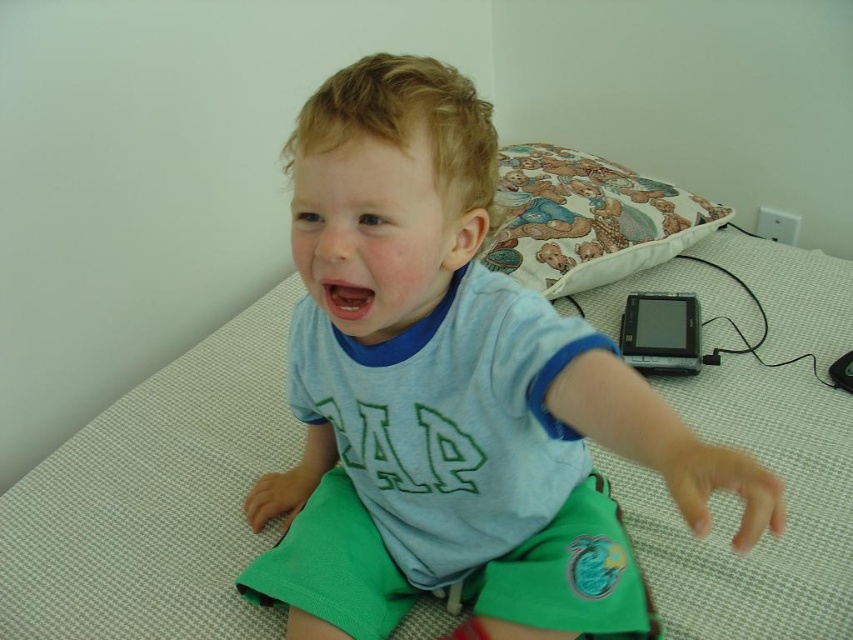
Question: Does light blue cotton shirt at center have a greater width compared to fluffy fabric pillow at upper right?

Choices:
 (A) no
 (B) yes

Answer: (A)

Question: Among these points, which one is nearest to the camera?

Choices:
 (A) (479, 304)
 (B) (627, 177)

Answer: (A)

Question: Among these points, which one is farthest from the camera?

Choices:
 (A) [x=563, y=188]
 (B) [x=448, y=132]

Answer: (A)

Question: Can you confirm if light blue cotton shirt at center is wider than fluffy fabric pillow at upper right?

Choices:
 (A) yes
 (B) no

Answer: (B)

Question: Does light blue cotton shirt at center come behind fluffy fabric pillow at upper right?

Choices:
 (A) no
 (B) yes

Answer: (A)